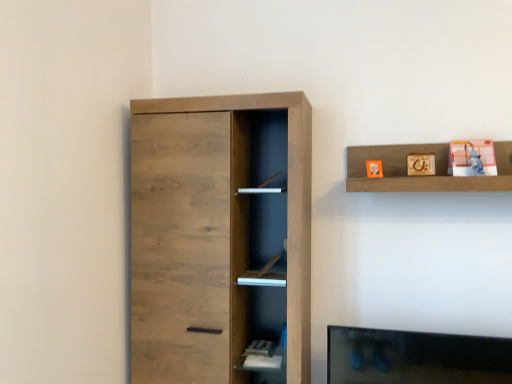
Question: In terms of width, does matte plastic photo frame at upper right, positioned as the second toy in left-to-right order, look wider or thinner when compared to natural wood cupboard at left?

Choices:
 (A) wide
 (B) thin

Answer: (B)

Question: Considering the positions of matte plastic photo frame at upper right, positioned as the second toy in left-to-right order, and natural wood cupboard at left in the image, is matte plastic photo frame at upper right, positioned as the second toy in left-to-right order, bigger or smaller than natural wood cupboard at left?

Choices:
 (A) big
 (B) small

Answer: (B)

Question: Estimate the real-world distances between objects in this image. Which object is farther from the natural wood cupboard at left?

Choices:
 (A) wooden shelf at upper right
 (B) matte orange cube at upper center, arranged as the first toy when viewed from the left
 (C) matte plastic photo frame at upper right, positioned as the second toy in left-to-right order

Answer: (C)

Question: Which is nearer to the natural wood cupboard at left?

Choices:
 (A) wooden shelf at upper right
 (B) matte plastic photo frame at upper right, the first toy when ordered from right to left
 (C) matte orange cube at upper center, which is the second toy in right-to-left order

Answer: (A)